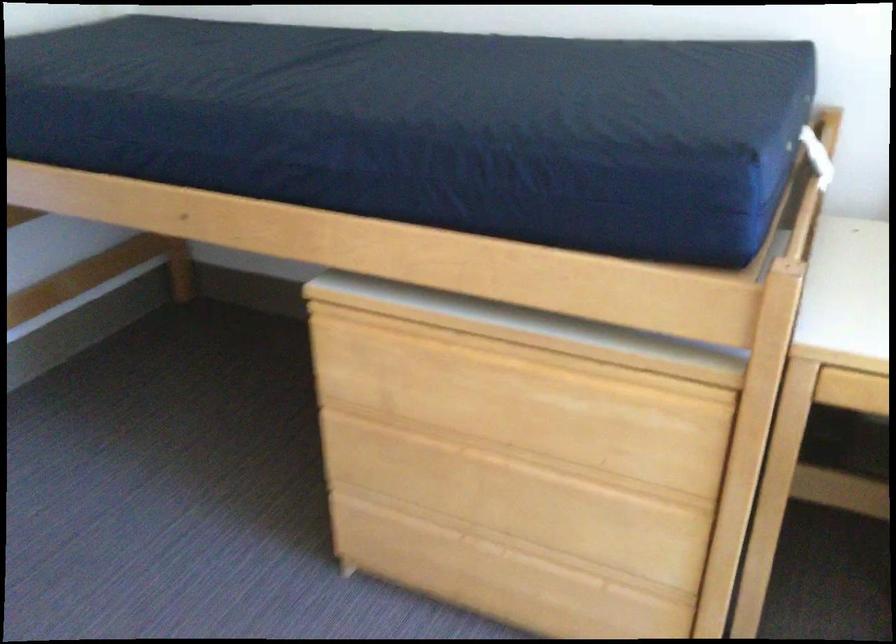
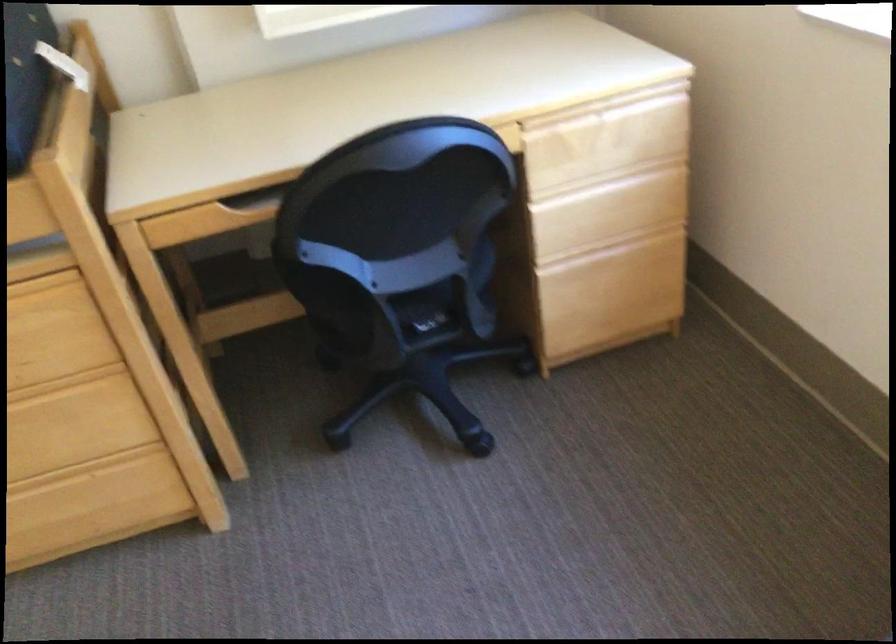
Find the pixel in the second image that matches (x=650, y=480) in the first image.

(64, 383)